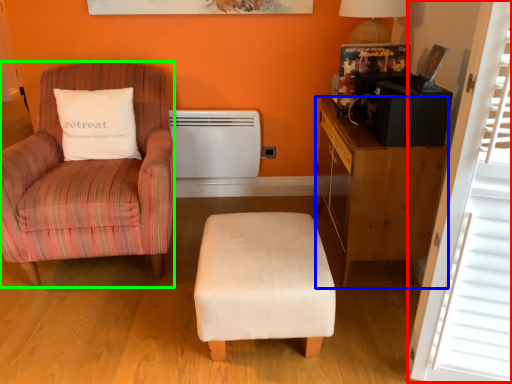
Question: Considering the real-world distances, which object is closest to window screen (highlighted by a red box)? desk (highlighted by a blue box) or chair (highlighted by a green box).

Choices:
 (A) desk
 (B) chair

Answer: (A)